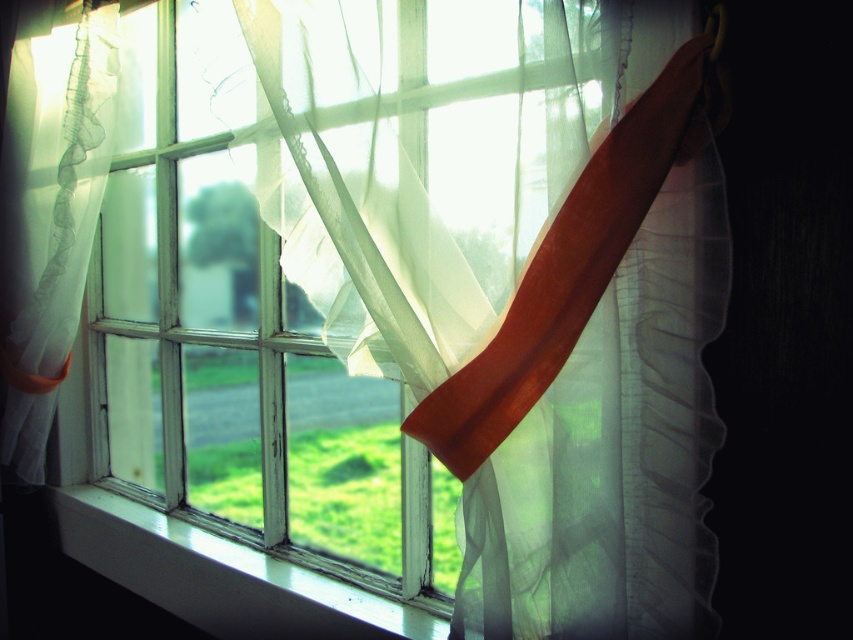
Question: Which of the following is the closest to the observer?

Choices:
 (A) white painted wood at lower center
 (B) translucent white curtain at center

Answer: (B)

Question: Can you confirm if translucent white curtain at center is positioned above white painted wood at lower center?

Choices:
 (A) yes
 (B) no

Answer: (A)

Question: Is translucent white curtain at center smaller than white painted wood at lower center?

Choices:
 (A) yes
 (B) no

Answer: (B)

Question: Does translucent white curtain at center have a greater width compared to white painted wood at lower center?

Choices:
 (A) no
 (B) yes

Answer: (A)